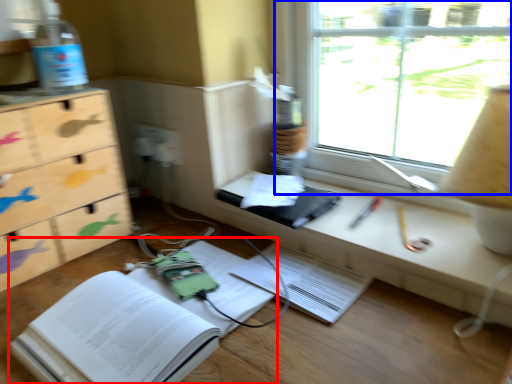
Question: Which of the following is the farthest to the observer, paperback book (highlighted by a red box) or window (highlighted by a blue box)?

Choices:
 (A) paperback book
 (B) window

Answer: (B)